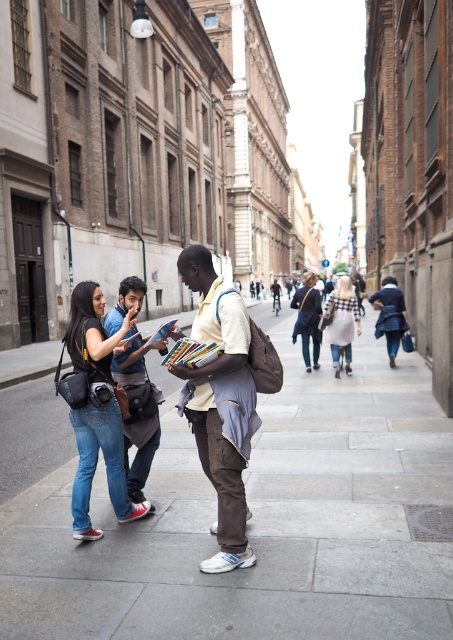
Consider the image. Is gray concrete pavement at center to the right of white checkered dress at center from the viewer's perspective?

No, gray concrete pavement at center is not to the right of white checkered dress at center.

Can you confirm if gray concrete pavement at center is smaller than white checkered dress at center?

No.

Between point (247, 532) and point (346, 323), which one is positioned in front?

Point (247, 532) is in front.

Find the location of a particular element. The height and width of the screenshot is (640, 453). gray concrete pavement at center is located at coordinates (261, 524).

Between point (119, 416) and point (289, 305), which one is positioned in front?

Point (119, 416) is in front.

Can you confirm if denim jeans at center is bigger than matte black jacket at center?

Actually, denim jeans at center might be smaller than matte black jacket at center.

Does point (77, 429) come farther from viewer compared to point (311, 276)?

No, it is not.

This screenshot has width=453, height=640. I want to click on denim jeans at center, so click(x=96, y=408).

Is point (297, 589) behind point (81, 524)?

That is False.

Which is more to the left, gray concrete pavement at center or denim jeans at center?

From the viewer's perspective, denim jeans at center appears more on the left side.

The height and width of the screenshot is (640, 453). In order to click on gray concrete pavement at center in this screenshot , I will do `click(261, 524)`.

Where is `gray concrete pavement at center`? gray concrete pavement at center is located at coordinates (261, 524).